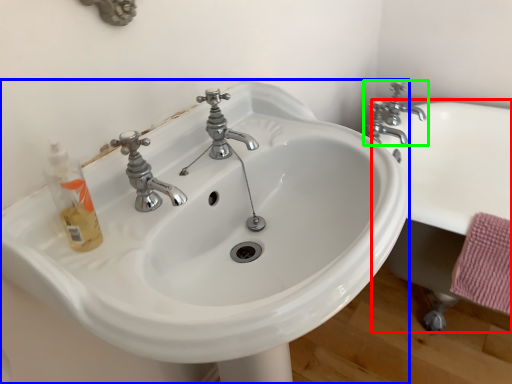
Question: Which object is the closest to the bath (highlighted by a red box)? Choose among these: sink (highlighted by a blue box) or tap (highlighted by a green box).

Choices:
 (A) sink
 (B) tap

Answer: (B)